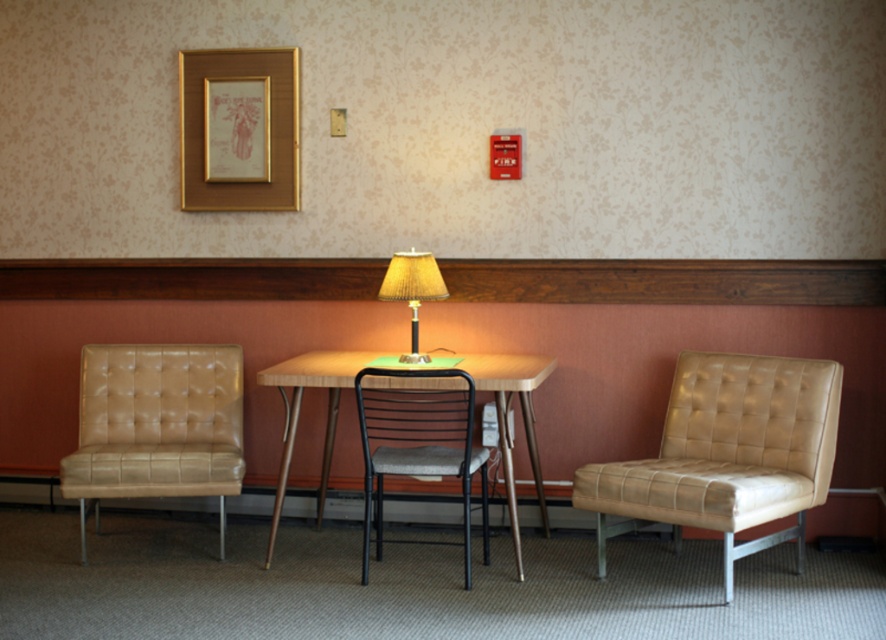
Between tan leather armchair at left and black metal chair at center, which one is positioned lower?

Positioned lower is black metal chair at center.

Is tan leather armchair at left positioned before black metal chair at center?

No, tan leather armchair at left is further to the viewer.

Find the location of a particular element. This screenshot has width=886, height=640. tan leather armchair at left is located at coordinates (156, 424).

Is gold metallic picture frame at upper center smaller than wooden table at center?

Yes.

Describe the element at coordinates (239, 129) in the screenshot. I see `gold metallic picture frame at upper center` at that location.

At what (x,y) coordinates should I click in order to perform the action: click on gold metallic picture frame at upper center. Please return your answer as a coordinate pair (x, y). Looking at the image, I should click on (239, 129).

Is matte leather armchair at right below tan leather armchair at left?

Correct, matte leather armchair at right is located below tan leather armchair at left.

Which is behind, point (756, 381) or point (149, 396)?

The point (149, 396) is behind.

Find the location of a particular element. matte leather armchair at right is located at coordinates click(x=727, y=452).